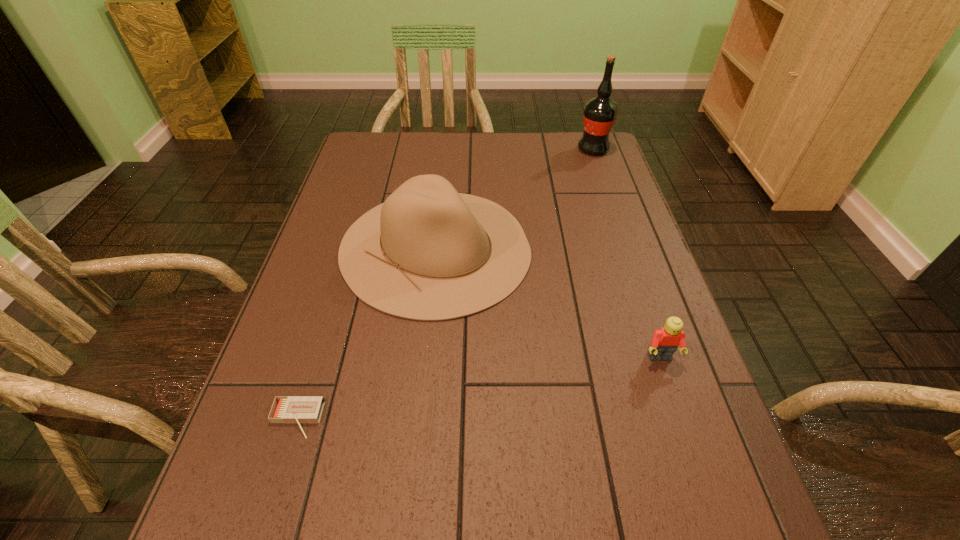
You are a GUI agent. You are given a task and a screenshot of the screen. Output one action in this format:
    pyautogui.click(x=<x>, y=<y>)
    Task: Click on the vacant space positioned on the face of the nearer green sunflower
    The width and height of the screenshot is (960, 540).
    Given the screenshot: What is the action you would take?
    pyautogui.click(x=501, y=310)

I want to click on vacant space positioned on the front-facing side of the third biggest yellow sunflower, so click(x=334, y=413).

In order to click on free space located 0.050m on the front-facing side of the sponge in this screenshot , I will do `click(449, 538)`.

The image size is (960, 540). What are the coordinates of `vacant region located 0.370m on the front-facing side of the smallest yellow sunflower` in the screenshot? It's located at point(433,418).

Locate an element on the screen. free space located 0.390m on the front-facing side of the smallest yellow sunflower is located at coordinates (422, 418).

This screenshot has height=540, width=960. What are the coordinates of `free space located on the front-facing side of the smallest yellow sunflower` in the screenshot? It's located at (481, 418).

Image resolution: width=960 pixels, height=540 pixels. Find the location of `object that is positioned at the far left corner`. object that is positioned at the far left corner is located at coordinates (426, 155).

Where is `vacant space at the far edge of the desktop`? The image size is (960, 540). vacant space at the far edge of the desktop is located at coordinates (464, 171).

Where is `free space at the left edge of the desktop`? The height and width of the screenshot is (540, 960). free space at the left edge of the desktop is located at coordinates pyautogui.click(x=300, y=422).

Image resolution: width=960 pixels, height=540 pixels. I want to click on free location at the right edge, so click(x=642, y=369).